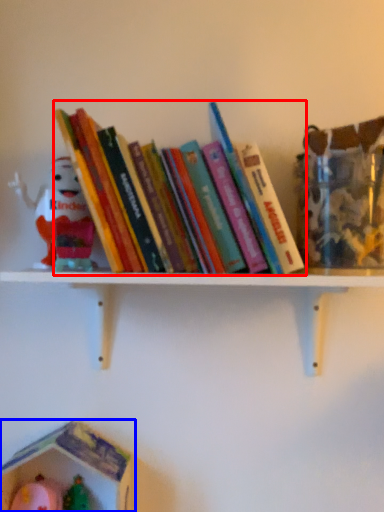
Question: Among these objects, which one is nearest to the camera, book (highlighted by a red box) or toy (highlighted by a blue box)?

Choices:
 (A) book
 (B) toy

Answer: (A)